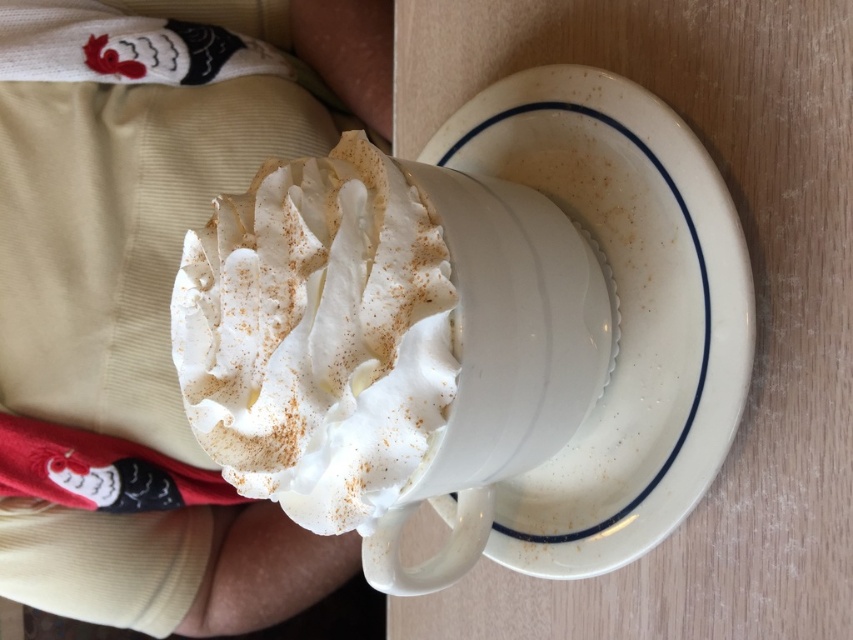
Question: Among these points, which one is farthest from the camera?

Choices:
 (A) (262, 38)
 (B) (456, 157)
 (C) (556, 360)

Answer: (A)

Question: Which of the following is the farthest from the observer?

Choices:
 (A) whipped cream at center
 (B) white ceramic saucer at center

Answer: (B)

Question: Which object is closer to the camera taking this photo?

Choices:
 (A) white ceramic mug at center
 (B) white cotton socks at lower left
 (C) white ceramic saucer at center
 (D) whipped cream at center

Answer: (D)

Question: Is white cotton socks at lower left thinner than white ceramic mug at center?

Choices:
 (A) no
 (B) yes

Answer: (A)

Question: Can you confirm if white cotton socks at lower left is bigger than white ceramic mug at center?

Choices:
 (A) no
 (B) yes

Answer: (B)

Question: Can you confirm if white ceramic saucer at center is positioned above whipped cream at center?

Choices:
 (A) no
 (B) yes

Answer: (B)